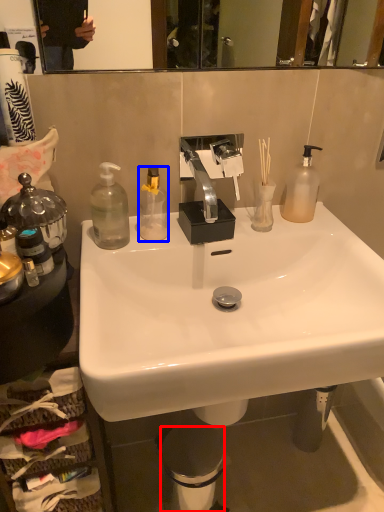
Question: Which point is closer to the camera, trash bin/can (highlighted by a red box) or bottle (highlighted by a blue box)?

Choices:
 (A) trash bin/can
 (B) bottle

Answer: (B)